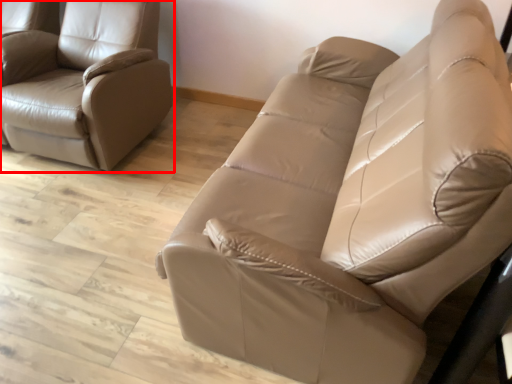
Question: From the image's perspective, where is chair (annotated by the red box) located in relation to studio couch in the image?

Choices:
 (A) above
 (B) below

Answer: (A)